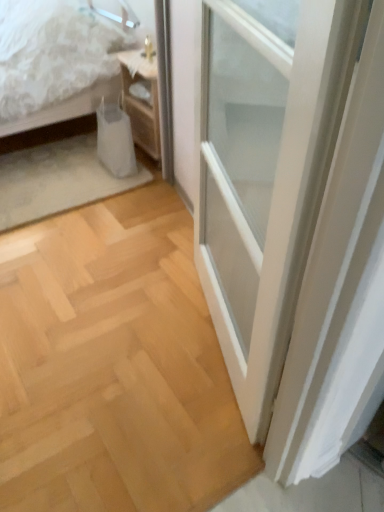
The width and height of the screenshot is (384, 512). What do you see at coordinates (61, 72) in the screenshot? I see `white textured bed at upper left` at bounding box center [61, 72].

Locate an element on the screen. This screenshot has height=512, width=384. white textured bed at upper left is located at coordinates (61, 72).

What is the approximate height of woodenmaterial/texturenightstand at upper left?

20.96 inches.

The image size is (384, 512). What do you see at coordinates (141, 101) in the screenshot?
I see `woodenmaterial/texturenightstand at upper left` at bounding box center [141, 101].

Where is `woodenmaterial/texturenightstand at upper left`? This screenshot has height=512, width=384. woodenmaterial/texturenightstand at upper left is located at coordinates (141, 101).

Identify the location of white textured bed at upper left. Image resolution: width=384 pixels, height=512 pixels. (61, 72).

Does woodenmaterial/texturenightstand at upper left appear on the right side of white textured bed at upper left?

Yes, woodenmaterial/texturenightstand at upper left is to the right of white textured bed at upper left.

Is woodenmaterial/texturenightstand at upper left positioned before white textured bed at upper left?

No, it is not.

Between point (154, 113) and point (1, 89), which one is positioned in front?

The point (1, 89) is more forward.

From the image's perspective, which is below, woodenmaterial/texturenightstand at upper left or white textured bed at upper left?

woodenmaterial/texturenightstand at upper left.

From a real-world perspective, who is located lower, woodenmaterial/texturenightstand at upper left or white textured bed at upper left?

From a 3D spatial view, woodenmaterial/texturenightstand at upper left is below.

Which object is thinner, woodenmaterial/texturenightstand at upper left or white textured bed at upper left?

With smaller width is woodenmaterial/texturenightstand at upper left.

Considering the relative sizes of woodenmaterial/texturenightstand at upper left and white textured bed at upper left in the image provided, is woodenmaterial/texturenightstand at upper left shorter than white textured bed at upper left?

Indeed, woodenmaterial/texturenightstand at upper left has a lesser height compared to white textured bed at upper left.

Which of these two, woodenmaterial/texturenightstand at upper left or white textured bed at upper left, is smaller?

With smaller size is woodenmaterial/texturenightstand at upper left.

Is white textured bed at upper left inside woodenmaterial/texturenightstand at upper left?

No.

Is there a large distance between woodenmaterial/texturenightstand at upper left and white textured bed at upper left?

woodenmaterial/texturenightstand at upper left is actually quite close to white textured bed at upper left.

Is woodenmaterial/texturenightstand at upper left positioned with its back to white textured bed at upper left?

No, woodenmaterial/texturenightstand at upper left's orientation is not away from white textured bed at upper left.

How different are the orientations of woodenmaterial/texturenightstand at upper left and white textured bed at upper left in degrees?

woodenmaterial/texturenightstand at upper left and white textured bed at upper left are facing 0.807 degrees away from each other.

Locate an element on the screen. The height and width of the screenshot is (512, 384). nightstand below the white textured bed at upper left (from the image's perspective) is located at coordinates (141, 101).

Which is more to the right, white textured bed at upper left or woodenmaterial/texturenightstand at upper left?

woodenmaterial/texturenightstand at upper left is more to the right.

Between white textured bed at upper left and woodenmaterial/texturenightstand at upper left, which one is positioned in front?

white textured bed at upper left.

Which is in front, point (28, 71) or point (151, 144)?

The point (28, 71) is closer.

From the image's perspective, is white textured bed at upper left under woodenmaterial/texturenightstand at upper left?

Actually, white textured bed at upper left appears above woodenmaterial/texturenightstand at upper left in the image.

From a real-world perspective, is white textured bed at upper left physically located above or below woodenmaterial/texturenightstand at upper left?

Clearly, from a real-world perspective, white textured bed at upper left is above woodenmaterial/texturenightstand at upper left.

From the picture: Between white textured bed at upper left and woodenmaterial/texturenightstand at upper left, which one has larger width?

With larger width is white textured bed at upper left.

Considering the relative sizes of white textured bed at upper left and woodenmaterial/texturenightstand at upper left in the image provided, is white textured bed at upper left taller than woodenmaterial/texturenightstand at upper left?

Indeed, white textured bed at upper left has a greater height compared to woodenmaterial/texturenightstand at upper left.

From the picture: Considering the relative sizes of white textured bed at upper left and woodenmaterial/texturenightstand at upper left in the image provided, is white textured bed at upper left bigger than woodenmaterial/texturenightstand at upper left?

Yes.

Is woodenmaterial/texturenightstand at upper left inside white textured bed at upper left?

That's incorrect, woodenmaterial/texturenightstand at upper left is not inside white textured bed at upper left.

Does white textured bed at upper left touch woodenmaterial/texturenightstand at upper left?

There is a gap between white textured bed at upper left and woodenmaterial/texturenightstand at upper left.

Could you tell me if white textured bed at upper left is turned towards woodenmaterial/texturenightstand at upper left?

No.

Where is `bed that appears above the woodenmaterial/texturenightstand at upper left (from the image's perspective)`? This screenshot has height=512, width=384. bed that appears above the woodenmaterial/texturenightstand at upper left (from the image's perspective) is located at coordinates (61, 72).

I want to click on nightstand located underneath the white textured bed at upper left (from a real-world perspective), so click(x=141, y=101).

You are a GUI agent. You are given a task and a screenshot of the screen. Output one action in this format:
    pyautogui.click(x=<x>, y=<y>)
    Task: Click on the nightstand on the right of white textured bed at upper left
    The image size is (384, 512).
    Given the screenshot: What is the action you would take?
    pyautogui.click(x=141, y=101)